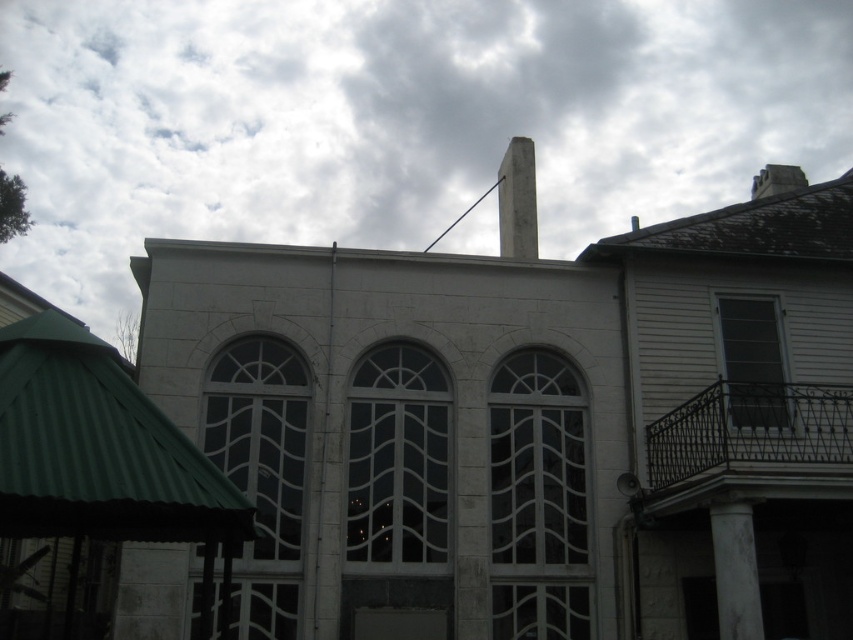
Question: Which object is farther from the camera taking this photo?

Choices:
 (A) white stone column at lower right
 (B) concrete at center
 (C) green corrugated metal canopy at lower left
 (D) white cloudy sky at upper center

Answer: (B)

Question: Considering the relative positions of white stone column at lower right and concrete at center in the image provided, where is white stone column at lower right located with respect to concrete at center?

Choices:
 (A) above
 (B) below

Answer: (B)

Question: Does white cloudy sky at upper center appear over concrete at center?

Choices:
 (A) yes
 (B) no

Answer: (A)

Question: Which object is positioned farthest from the white cloudy sky at upper center?

Choices:
 (A) white stone column at lower right
 (B) green corrugated metal canopy at lower left
 (C) concrete at center

Answer: (B)

Question: Does green corrugated metal canopy at lower left have a greater width compared to concrete at center?

Choices:
 (A) no
 (B) yes

Answer: (A)

Question: Which object appears farthest from the camera in this image?

Choices:
 (A) green corrugated metal canopy at lower left
 (B) white cloudy sky at upper center
 (C) white stone column at lower right

Answer: (B)